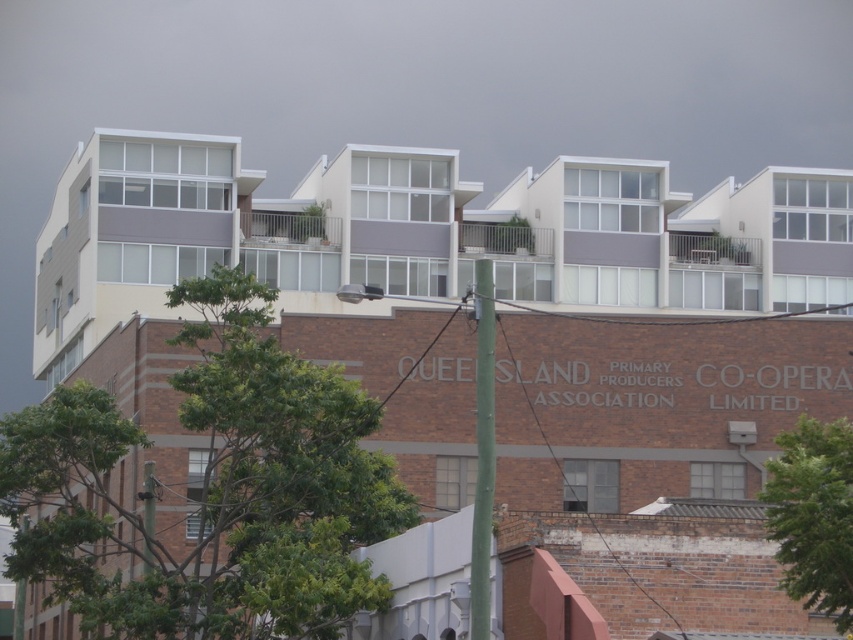
Can you confirm if green leafy tree at lower right is wider than green textured pole at center?

Correct, the width of green leafy tree at lower right exceeds that of green textured pole at center.

Is point (839, 564) closer to viewer compared to point (486, 625)?

Yes, point (839, 564) is in front of point (486, 625).

Identify the location of green leafy tree at lower right. (813, 515).

Can you confirm if green leafy tree at upper center is thinner than green leafy tree at lower right?

Incorrect, green leafy tree at upper center's width is not less than green leafy tree at lower right's.

Which is in front, point (345, 394) or point (828, 490)?

Point (828, 490)

This screenshot has height=640, width=853. In order to click on green leafy tree at upper center in this screenshot , I will do `click(212, 490)`.

Find the location of a particular element. This screenshot has width=853, height=640. green leafy tree at upper center is located at coordinates (212, 490).

Which is behind, point (358, 499) or point (486, 438)?

The point (358, 499) is behind.

Does green leafy tree at upper center appear on the right side of green textured pole at center?

In fact, green leafy tree at upper center is to the left of green textured pole at center.

Measure the distance between point (276, 556) and camera.

Point (276, 556) is 54.27 meters from camera.

Locate an element on the screen. green leafy tree at upper center is located at coordinates (212, 490).